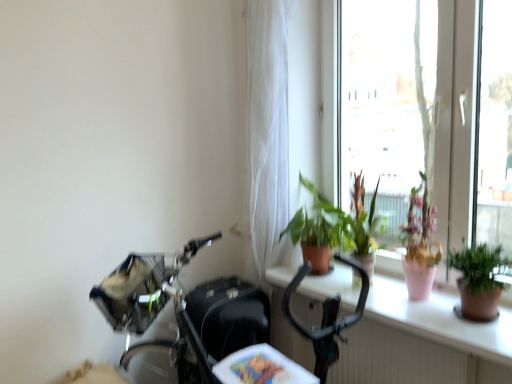
The width and height of the screenshot is (512, 384). Find the location of `free space below green matte plant at upper right, the 2th houseplant when ordered from left to right (from a real-world perspective)`. free space below green matte plant at upper right, the 2th houseplant when ordered from left to right (from a real-world perspective) is located at coordinates (478, 325).